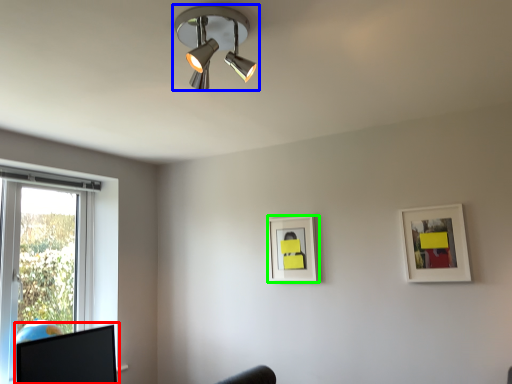
Question: Which object is positioned closest to computer monitor (highlighted by a red box)? Select from lamp (highlighted by a blue box) and picture frame (highlighted by a green box).

Choices:
 (A) lamp
 (B) picture frame

Answer: (B)